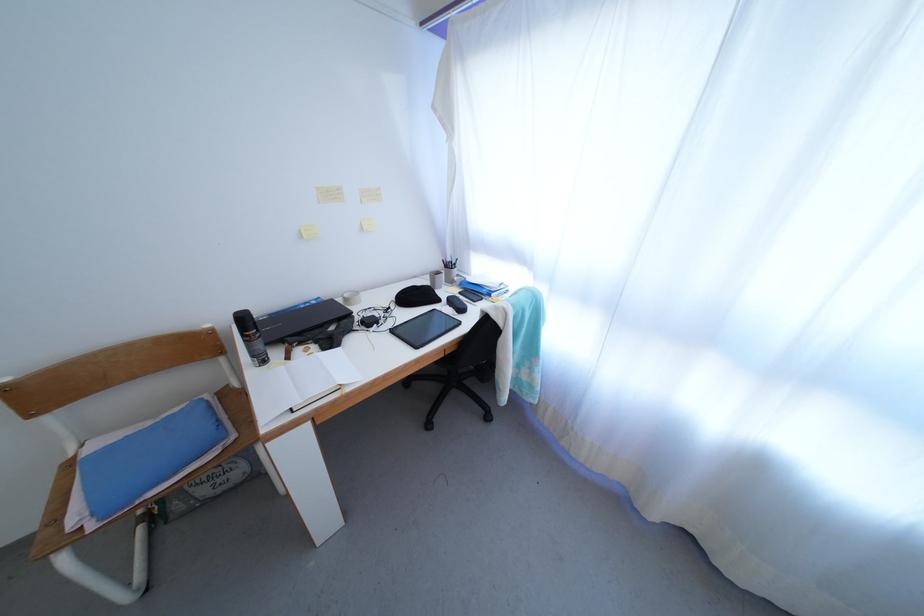
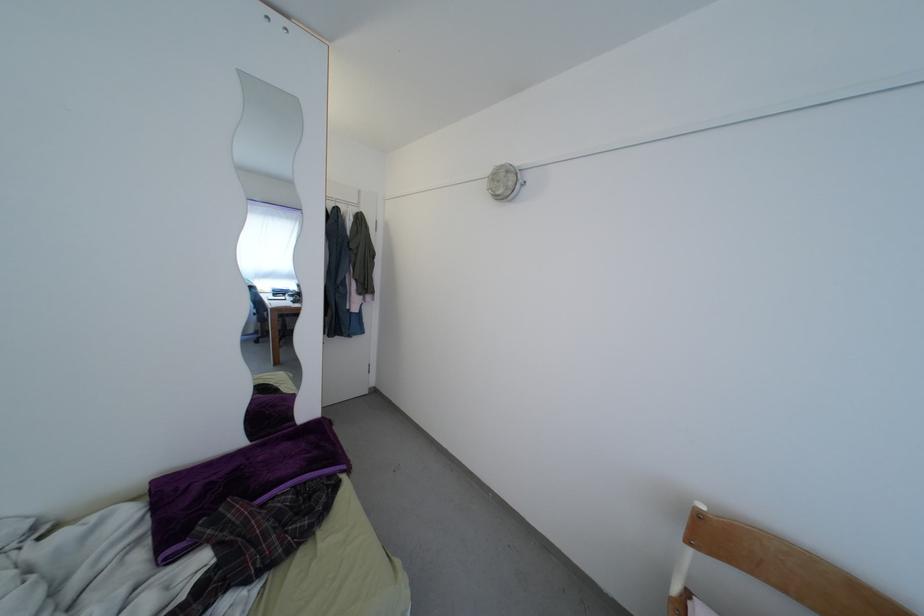
Where in the second image is the point corresponding to (37,422) from the first image?

(694, 548)